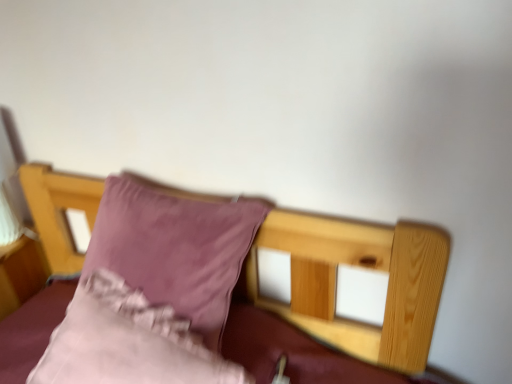
Question: Is velvet pink pillow at center, positioned as the 1th pillow in top-to-bottom order, spatially inside pink satin pillow at center, which is the 1th pillow from bottom to top, or outside of it?

Choices:
 (A) outside
 (B) inside

Answer: (A)

Question: Relative to pink satin pillow at center, which is the 1th pillow from bottom to top, is velvet pink pillow at center, which is the 2th pillow from bottom to top, in front or behind?

Choices:
 (A) behind
 (B) front

Answer: (A)

Question: Considering the positions of point (198, 307) and point (138, 321), is point (198, 307) closer or farther from the camera than point (138, 321)?

Choices:
 (A) closer
 (B) farther

Answer: (B)

Question: From the image's perspective, is pink satin pillow at center, acting as the 2th pillow starting from the top, above or below velvet pink pillow at center, positioned as the 1th pillow in top-to-bottom order?

Choices:
 (A) below
 (B) above

Answer: (A)

Question: From a real-world perspective, relative to velvet pink pillow at center, positioned as the 1th pillow in top-to-bottom order, is pink satin pillow at center, acting as the 2th pillow starting from the top, vertically above or below?

Choices:
 (A) above
 (B) below

Answer: (B)

Question: Does point (154, 375) appear closer or farther from the camera than point (194, 297)?

Choices:
 (A) farther
 (B) closer

Answer: (B)

Question: In terms of height, does pink satin pillow at center, acting as the 2th pillow starting from the top, look taller or shorter compared to velvet pink pillow at center, which is the 2th pillow from bottom to top?

Choices:
 (A) short
 (B) tall

Answer: (A)